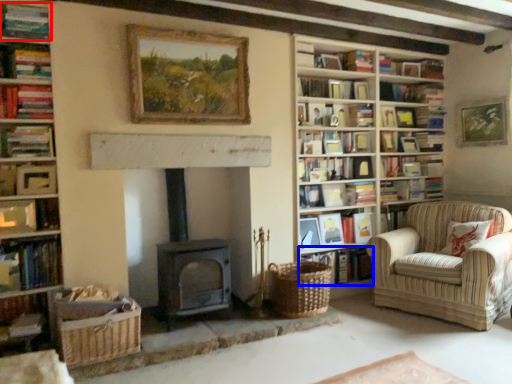
Question: Which point is closer to the camera, book (highlighted by a red box) or book (highlighted by a blue box)?

Choices:
 (A) book
 (B) book

Answer: (A)